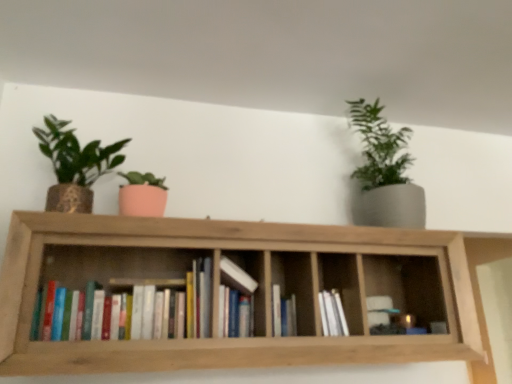
Question: Is matte gold pot at left, which appears as the second houseplant when viewed from the right, located within hardcover books at center, the 3th book when ordered from right to left?

Choices:
 (A) yes
 (B) no

Answer: (B)

Question: Is hardcover books at center, which appears as the 1th book when viewed from the left, placed right next to matte gold pot at left, which is the 1th houseplant from left to right?

Choices:
 (A) yes
 (B) no

Answer: (B)

Question: Is hardcover books at center, the 3th book when ordered from right to left, at the right side of matte gold pot at left, which is the 1th houseplant from left to right?

Choices:
 (A) no
 (B) yes

Answer: (B)

Question: Is hardcover books at center, which appears as the 1th book when viewed from the left, smaller than matte gold pot at left, which appears as the second houseplant when viewed from the right?

Choices:
 (A) yes
 (B) no

Answer: (A)

Question: Is hardcover books at center, which appears as the 1th book when viewed from the left, bigger than matte gold pot at left, which appears as the second houseplant when viewed from the right?

Choices:
 (A) yes
 (B) no

Answer: (B)

Question: From the image's perspective, relative to wooden bookshelf at center, is hardcover book at center, the third book viewed from the left, above or below?

Choices:
 (A) below
 (B) above

Answer: (A)

Question: Would you say hardcover book at center, the third book viewed from the left, is to the left or to the right of wooden bookshelf at center in the picture?

Choices:
 (A) right
 (B) left

Answer: (A)

Question: From their relative heights in the image, would you say hardcover book at center, which is the first book from right to left, is taller or shorter than wooden bookshelf at center?

Choices:
 (A) short
 (B) tall

Answer: (A)

Question: Considering the positions of hardcover book at center, the third book viewed from the left, and wooden bookshelf at center in the image, is hardcover book at center, the third book viewed from the left, bigger or smaller than wooden bookshelf at center?

Choices:
 (A) small
 (B) big

Answer: (A)

Question: From the image's perspective, is matte gold pot at left, which appears as the second houseplant when viewed from the right, positioned above or below white matte books at center?

Choices:
 (A) above
 (B) below

Answer: (A)

Question: From their relative heights in the image, would you say matte gold pot at left, which appears as the second houseplant when viewed from the right, is taller or shorter than white matte books at center?

Choices:
 (A) tall
 (B) short

Answer: (A)

Question: In the image, is matte gold pot at left, which is the 1th houseplant from left to right, positioned in front of or behind white matte books at center?

Choices:
 (A) front
 (B) behind

Answer: (A)

Question: Do you think matte gold pot at left, which appears as the second houseplant when viewed from the right, is within white matte books at center, or outside of it?

Choices:
 (A) inside
 (B) outside

Answer: (B)

Question: Does point (283, 317) appear closer or farther from the camera than point (193, 304)?

Choices:
 (A) farther
 (B) closer

Answer: (A)

Question: Based on their sizes in the image, would you say hardcover book at center, the third book viewed from the left, is bigger or smaller than hardcover books at center, which appears as the 1th book when viewed from the left?

Choices:
 (A) small
 (B) big

Answer: (A)